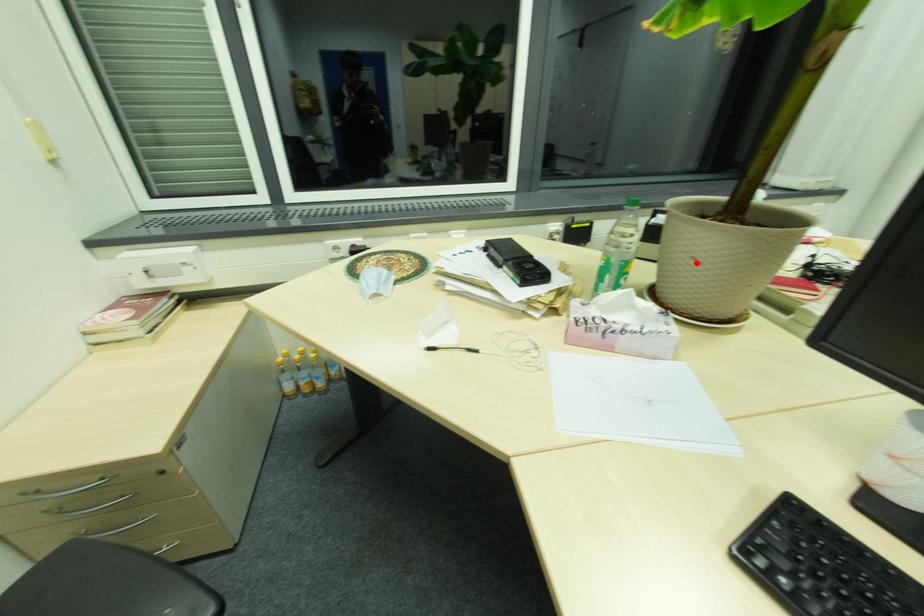
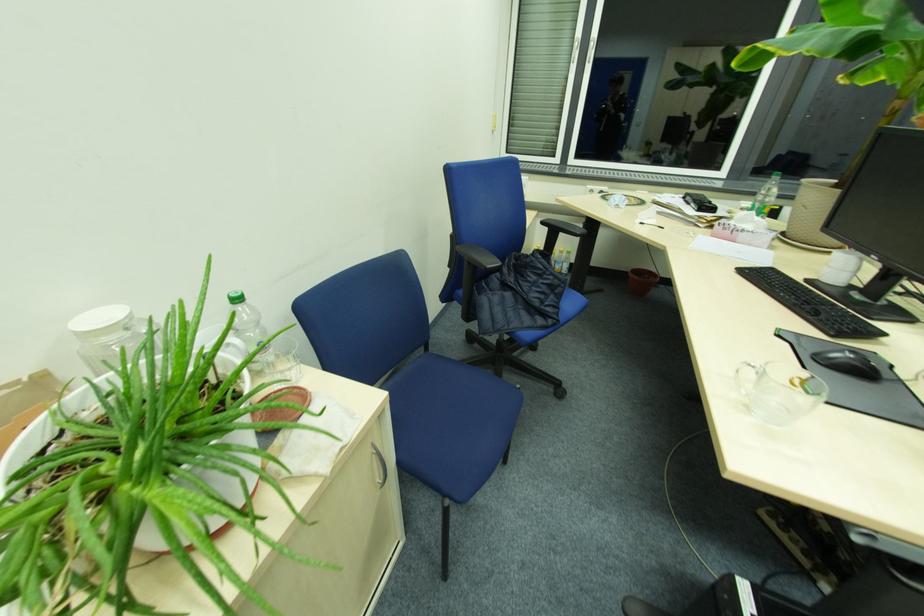
Locate, in the second image, the point that corresponds to the highlighted location in the first image.

(808, 209)